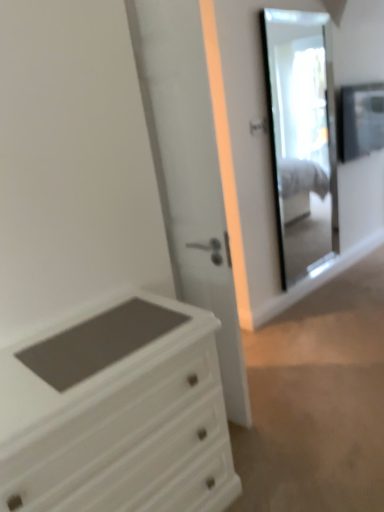
Question: Is matte black frame at upper right smaller than clear glass mirror at upper right?

Choices:
 (A) no
 (B) yes

Answer: (B)

Question: Considering the relative sizes of matte black frame at upper right and clear glass mirror at upper right in the image provided, is matte black frame at upper right thinner than clear glass mirror at upper right?

Choices:
 (A) yes
 (B) no

Answer: (B)

Question: From a real-world perspective, does matte black frame at upper right sit lower than clear glass mirror at upper right?

Choices:
 (A) yes
 (B) no

Answer: (B)

Question: From the image's perspective, is matte black frame at upper right below clear glass mirror at upper right?

Choices:
 (A) yes
 (B) no

Answer: (B)

Question: Does matte black frame at upper right appear on the left side of clear glass mirror at upper right?

Choices:
 (A) no
 (B) yes

Answer: (A)

Question: From their relative heights in the image, would you say clear glass mirror at upper right is taller or shorter than white glossy door at center?

Choices:
 (A) short
 (B) tall

Answer: (A)

Question: Looking at their shapes, would you say clear glass mirror at upper right is wider or thinner than white glossy door at center?

Choices:
 (A) thin
 (B) wide

Answer: (A)

Question: Looking at the image, does clear glass mirror at upper right seem bigger or smaller compared to white glossy door at center?

Choices:
 (A) small
 (B) big

Answer: (A)

Question: From a real-world perspective, is clear glass mirror at upper right positioned above or below white glossy door at center?

Choices:
 (A) below
 (B) above

Answer: (B)

Question: Is point (342, 106) closer or farther from the camera than point (281, 120)?

Choices:
 (A) closer
 (B) farther

Answer: (A)

Question: In the image, is matte black frame at upper right on the left side or the right side of clear glass mirror at upper right?

Choices:
 (A) right
 (B) left

Answer: (A)

Question: From a real-world perspective, is matte black frame at upper right above or below clear glass mirror at upper right?

Choices:
 (A) below
 (B) above

Answer: (B)

Question: Is matte black frame at upper right in front of or behind clear glass mirror at upper right in the image?

Choices:
 (A) behind
 (B) front

Answer: (A)

Question: Do you think clear glass mirror at upper right is within matte black frame at upper right, or outside of it?

Choices:
 (A) inside
 (B) outside

Answer: (B)

Question: Considering the positions of point (266, 45) and point (372, 105), is point (266, 45) closer or farther from the camera than point (372, 105)?

Choices:
 (A) farther
 (B) closer

Answer: (A)